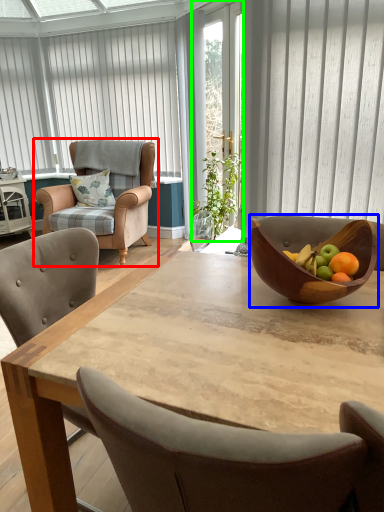
Question: Based on their relative distances, which object is nearer to chair (highlighted by a red box)? Choose from bowl (highlighted by a blue box) and screen door (highlighted by a green box).

Choices:
 (A) bowl
 (B) screen door

Answer: (B)